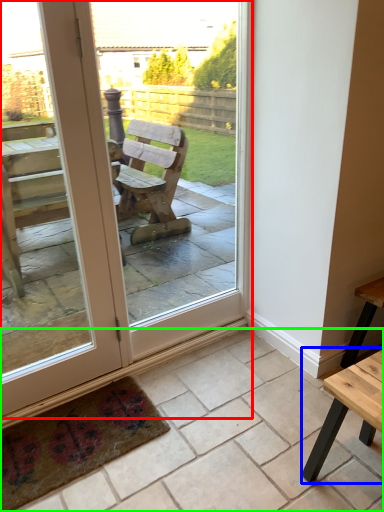
Question: Which object is positioned closest to door (highlighted by a red box)? Select from table (highlighted by a blue box) and tile (highlighted by a green box).

Choices:
 (A) table
 (B) tile

Answer: (B)